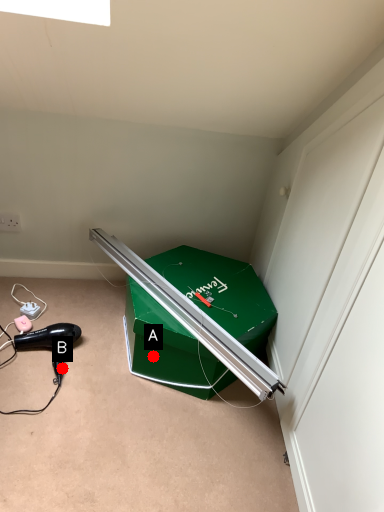
Question: Two points are circled on the image, labeled by A and B beside each circle. Which point is farther to the camera?

Choices:
 (A) A is further
 (B) B is further

Answer: (B)